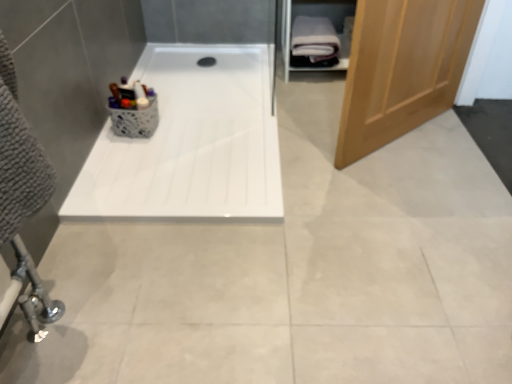
Find the location of `white glossy bathtub at center`. white glossy bathtub at center is located at coordinates point(191,142).

Locate an element on the screen. The height and width of the screenshot is (384, 512). white soft towel at upper right is located at coordinates [314, 42].

Considering the positions of point (330, 56) and point (418, 107), is point (330, 56) closer or farther from the camera than point (418, 107)?

Point (330, 56).

From the image's perspective, is white soft towel at upper right located above light brown wooden door at right?

Yes, from the image's perspective, white soft towel at upper right is on top of light brown wooden door at right.

In the scene shown: From a real-world perspective, which is physically below, white soft towel at upper right or light brown wooden door at right?

white soft towel at upper right, from a real-world perspective.

Relative to light brown wooden door at right, is white soft towel at upper right in front or behind?

white soft towel at upper right is positioned farther from the viewer than light brown wooden door at right.

Considering the points (435, 111) and (307, 33), which point is behind, point (435, 111) or point (307, 33)?

Positioned behind is point (307, 33).

From a real-world perspective, is light brown wooden door at right physically below white soft towel at upper right?

Incorrect, from a real-world perspective, light brown wooden door at right is higher than white soft towel at upper right.

Does light brown wooden door at right appear on the left side of white soft towel at upper right?

In fact, light brown wooden door at right is to the right of white soft towel at upper right.

Considering the sizes of objects white soft towel at upper right and white glossy bathtub at center in the image provided, who is wider, white soft towel at upper right or white glossy bathtub at center?

Wider between the two is white glossy bathtub at center.

Is point (314, 47) positioned behind point (226, 146)?

Yes.

Between white soft towel at upper right and white glossy bathtub at center, which one has smaller size?

Smaller between the two is white soft towel at upper right.

Can we say light brown wooden door at right lies outside white glossy bathtub at center?

Indeed, light brown wooden door at right is completely outside white glossy bathtub at center.

From a real-world perspective, between light brown wooden door at right and white glossy bathtub at center, who is vertically higher?

In real-world perspective, light brown wooden door at right is above.

Is point (370, 145) farther from viewer compared to point (210, 130)?

No, it is not.

Is light brown wooden door at right aimed at white glossy bathtub at center?

No, light brown wooden door at right is not oriented towards white glossy bathtub at center.

Image resolution: width=512 pixels, height=384 pixels. I want to click on bathtub below the light brown wooden door at right (from the image's perspective), so click(191, 142).

Is white glossy bathtub at center oriented away from light brown wooden door at right?

No, white glossy bathtub at center is not facing away from light brown wooden door at right.

Based on the photo, considering the sizes of objects white glossy bathtub at center and light brown wooden door at right in the image provided, who is shorter, white glossy bathtub at center or light brown wooden door at right?

With less height is white glossy bathtub at center.

From a real-world perspective, between white glossy bathtub at center and light brown wooden door at right, who is vertically higher?

light brown wooden door at right.

Can you tell me how much white glossy bathtub at center and white soft towel at upper right differ in facing direction?

The facing directions of white glossy bathtub at center and white soft towel at upper right are 1.11 degrees apart.

Between point (142, 187) and point (317, 43), which one is positioned in front?

The point (142, 187) is closer to the camera.

Can you confirm if white glossy bathtub at center is positioned to the right of white soft towel at upper right?

No, white glossy bathtub at center is not to the right of white soft towel at upper right.

Image resolution: width=512 pixels, height=384 pixels. I want to click on bath towel behind the light brown wooden door at right, so click(314, 42).

The width and height of the screenshot is (512, 384). I want to click on door that appears below the white soft towel at upper right (from the image's perspective), so click(x=402, y=69).

When comparing their distances from white glossy bathtub at center, does white soft towel at upper right or light brown wooden door at right seem further?

white soft towel at upper right is further to white glossy bathtub at center.

Based on their spatial positions, is white soft towel at upper right or white glossy bathtub at center further from light brown wooden door at right?

white soft towel at upper right.

Estimate the real-world distances between objects in this image. Which object is further from white soft towel at upper right, light brown wooden door at right or white glossy bathtub at center?

light brown wooden door at right lies further to white soft towel at upper right than the other object.

When comparing their distances from light brown wooden door at right, does white glossy bathtub at center or white soft towel at upper right seem closer?

white glossy bathtub at center is closer to light brown wooden door at right.

Estimate the real-world distances between objects in this image. Which object is further from white glossy bathtub at center, light brown wooden door at right or white soft towel at upper right?

The object further to white glossy bathtub at center is white soft towel at upper right.

When comparing their distances from white soft towel at upper right, does white glossy bathtub at center or light brown wooden door at right seem further?

Among the two, light brown wooden door at right is located further to white soft towel at upper right.

Locate an element on the screen. This screenshot has width=512, height=384. bathtub between light brown wooden door at right and white soft towel at upper right from front to back is located at coordinates (191, 142).